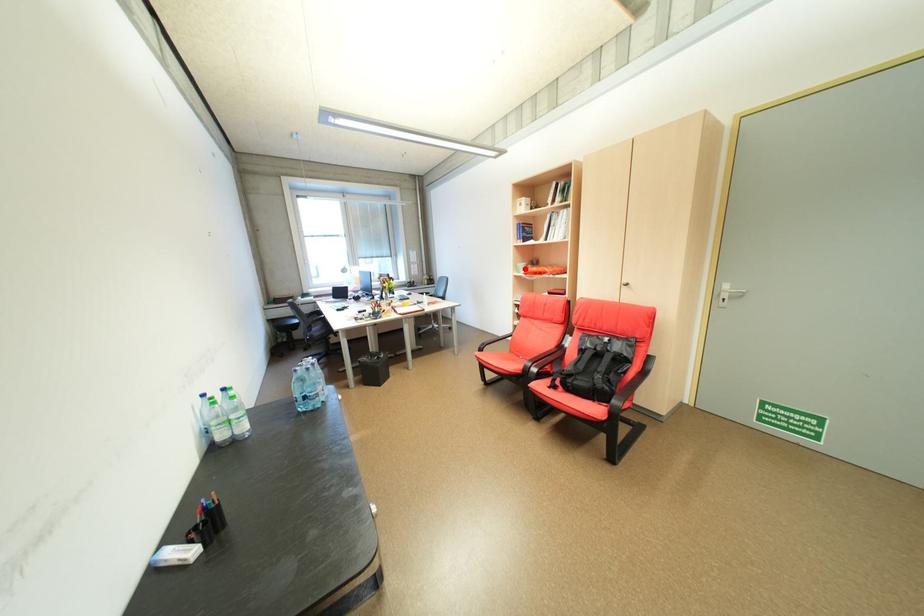
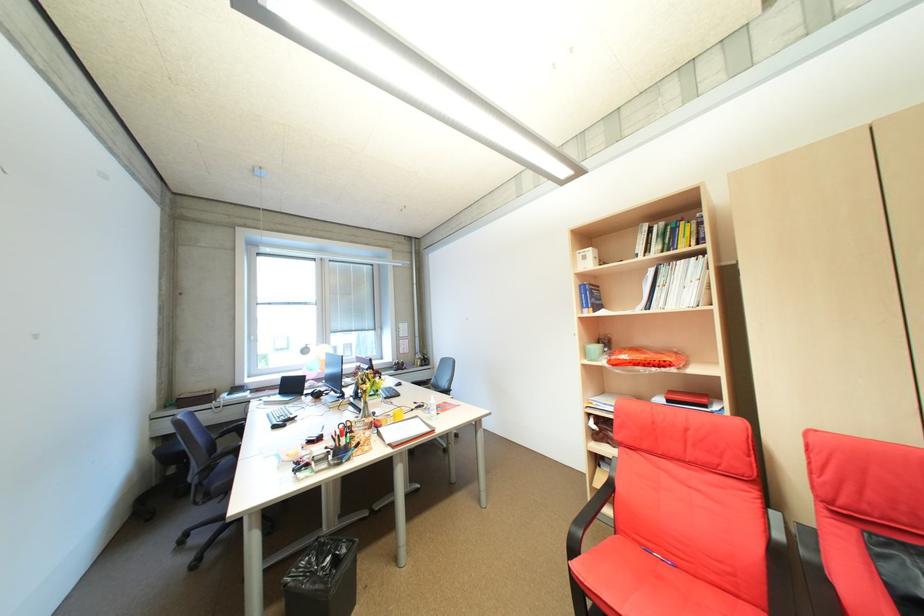
Question: I am providing you with two images of the same scene from different viewpoints. A red point is shown in image1. For the corresponding object point in image2, is it positioned nearer or farther from the camera?

Choices:
 (A) Nearer
 (B) Farther

Answer: (B)